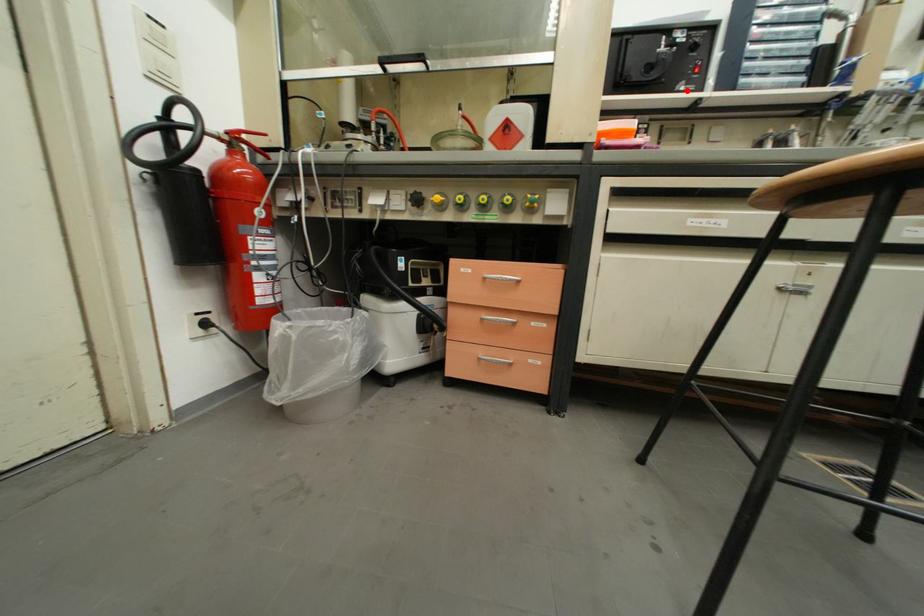
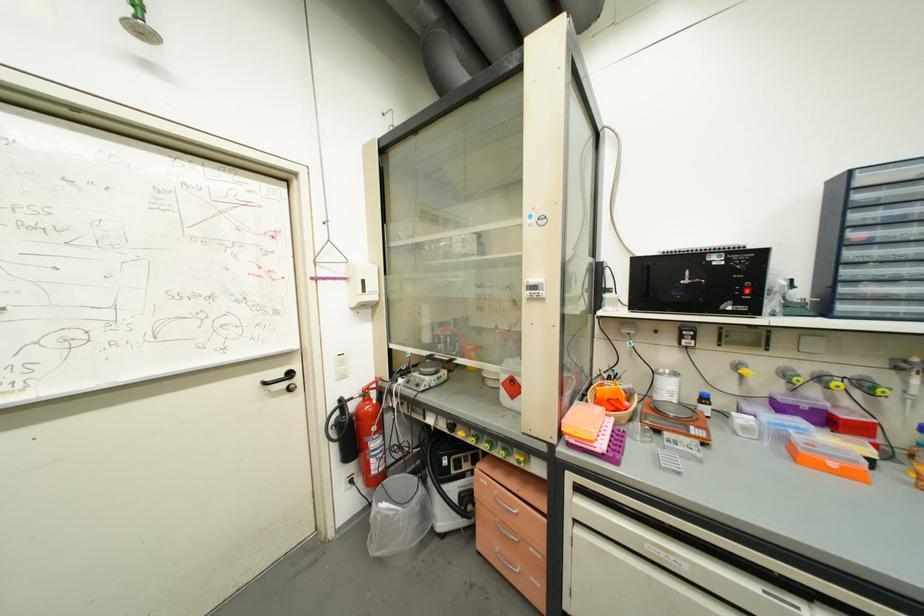
In the second image, find the point that corresponds to the highlighted location in the first image.

(735, 310)